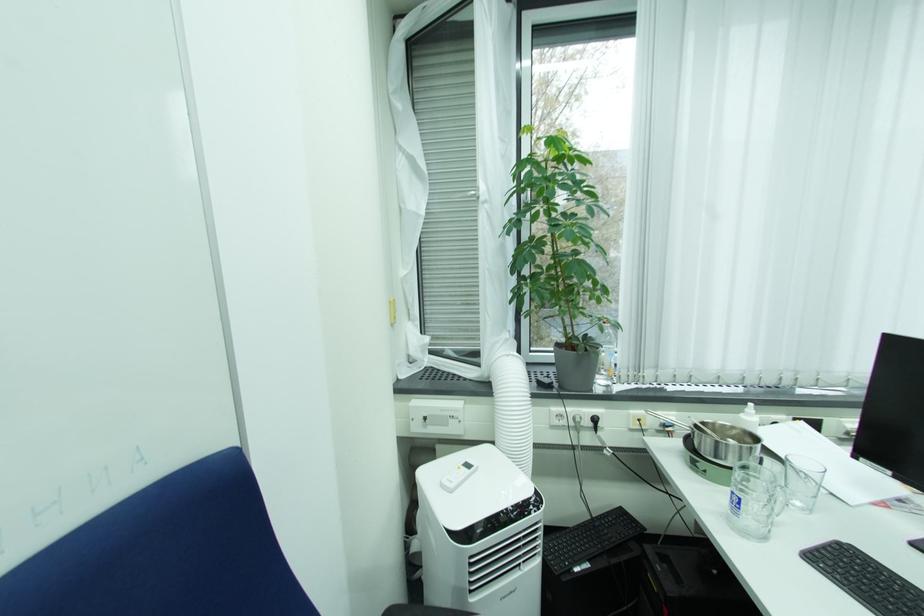
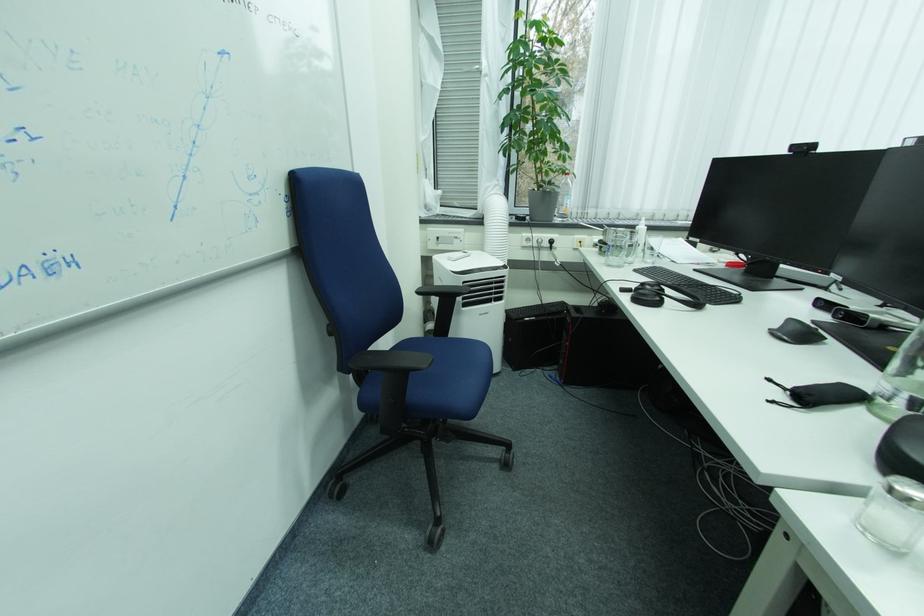
Where in the second image is the point corresponding to the point at 748,416 from the first image?

(643, 227)